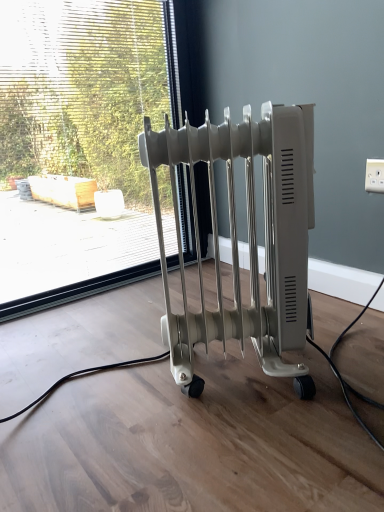
Question: From a real-world perspective, is transparent glass window at center above or below white plastic outlet at upper right?

Choices:
 (A) above
 (B) below

Answer: (A)

Question: Relative to white plastic outlet at upper right, is transparent glass window at center in front or behind?

Choices:
 (A) behind
 (B) front

Answer: (A)

Question: Which object is positioned farthest from the transparent glass window at center?

Choices:
 (A) white plastic radiator at center
 (B) white plastic outlet at upper right

Answer: (B)

Question: Estimate the real-world distances between objects in this image. Which object is farther from the white plastic outlet at upper right?

Choices:
 (A) white plastic radiator at center
 (B) transparent glass window at center

Answer: (B)